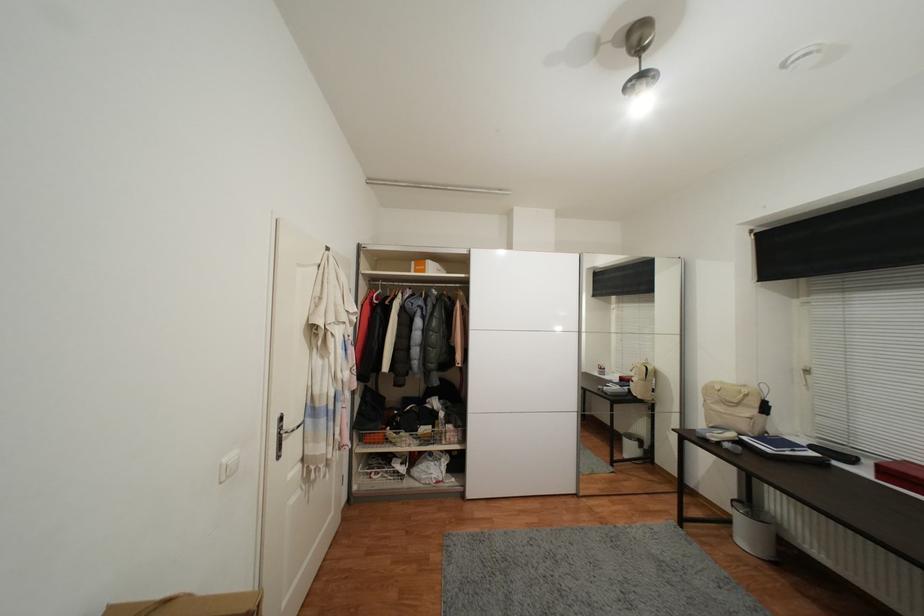
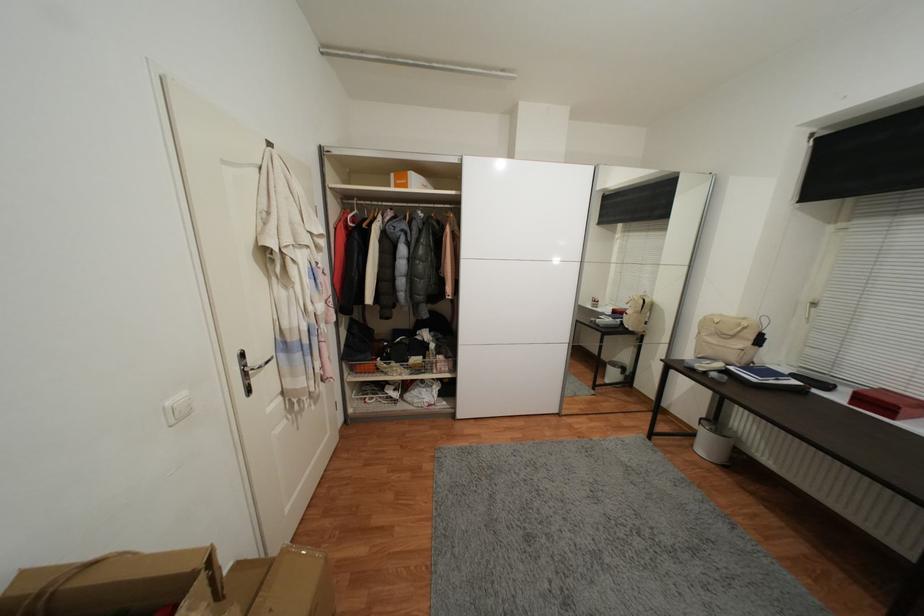
Where in the second image is the point corresponding to (286,430) from the first image?

(249, 367)